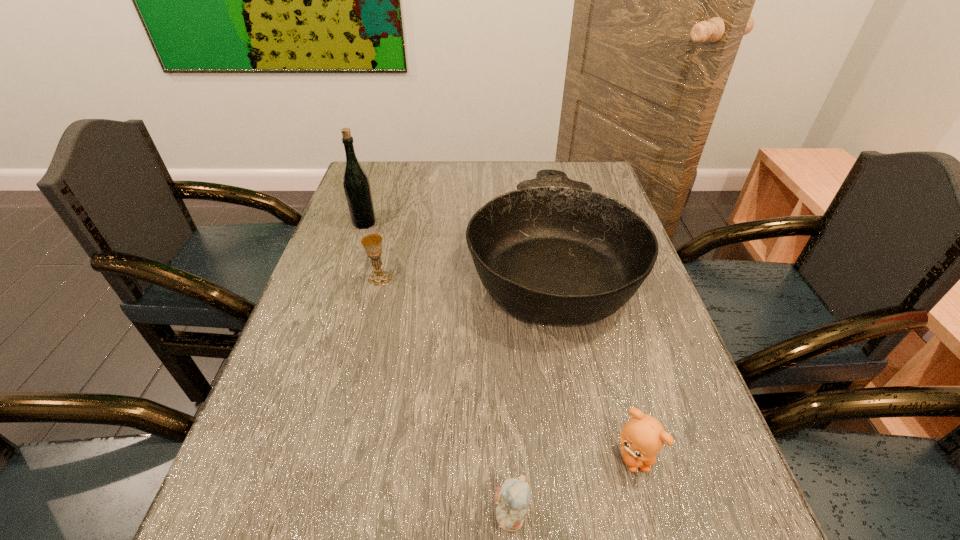
I want to click on vacant space located 0.060m on the face of the farther teddy bear, so pyautogui.click(x=649, y=514).

Where is `beer bottle present at the left edge`? The height and width of the screenshot is (540, 960). beer bottle present at the left edge is located at coordinates (357, 189).

You are a GUI agent. You are given a task and a screenshot of the screen. Output one action in this format:
    pyautogui.click(x=<x>, y=<y>)
    Task: Click on the chalice at the left edge
    The width and height of the screenshot is (960, 540).
    Given the screenshot: What is the action you would take?
    pyautogui.click(x=372, y=243)

Find the location of a particular element. This screenshot has height=540, width=960. frying pan that is positioned at the right edge is located at coordinates (553, 251).

The image size is (960, 540). I want to click on teddy bear positioned at the right edge, so click(x=642, y=437).

Find the location of a particular element. This screenshot has width=960, height=540. vacant area at the far edge of the desktop is located at coordinates (445, 177).

In the image, there is a desktop. At what (x,y) coordinates should I click in order to perform the action: click on vacant space at the near edge. Please return your answer as a coordinate pair (x, y). Looking at the image, I should click on (392, 536).

The height and width of the screenshot is (540, 960). I want to click on vacant space at the left edge, so pos(279,450).

Find the location of a particular element. The height and width of the screenshot is (540, 960). vacant space at the right edge of the desktop is located at coordinates (660, 360).

In order to click on vacant space at the far right corner of the desktop in this screenshot , I will do `click(597, 183)`.